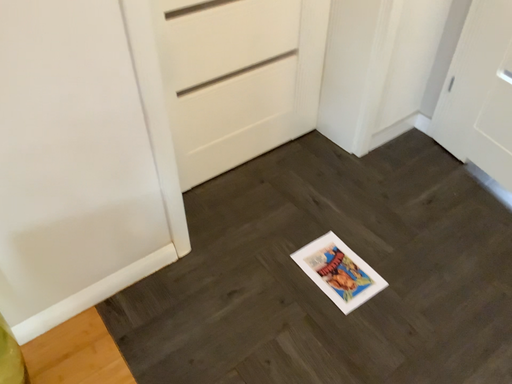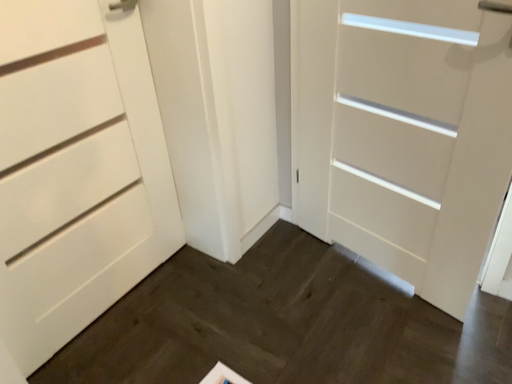
Question: Which way did the camera rotate in the video?

Choices:
 (A) rotated upward
 (B) rotated downward

Answer: (A)